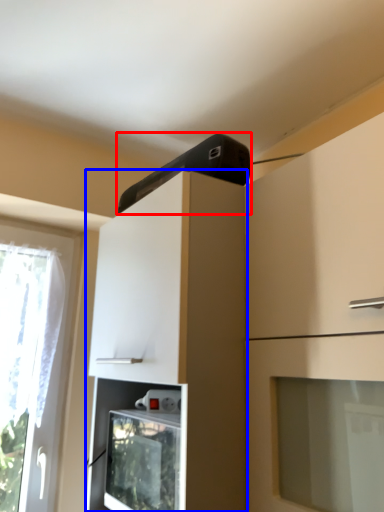
Question: Among these objects, which one is nearest to the camera, appliance (highlighted by a red box) or cabinetry (highlighted by a blue box)?

Choices:
 (A) appliance
 (B) cabinetry

Answer: (B)